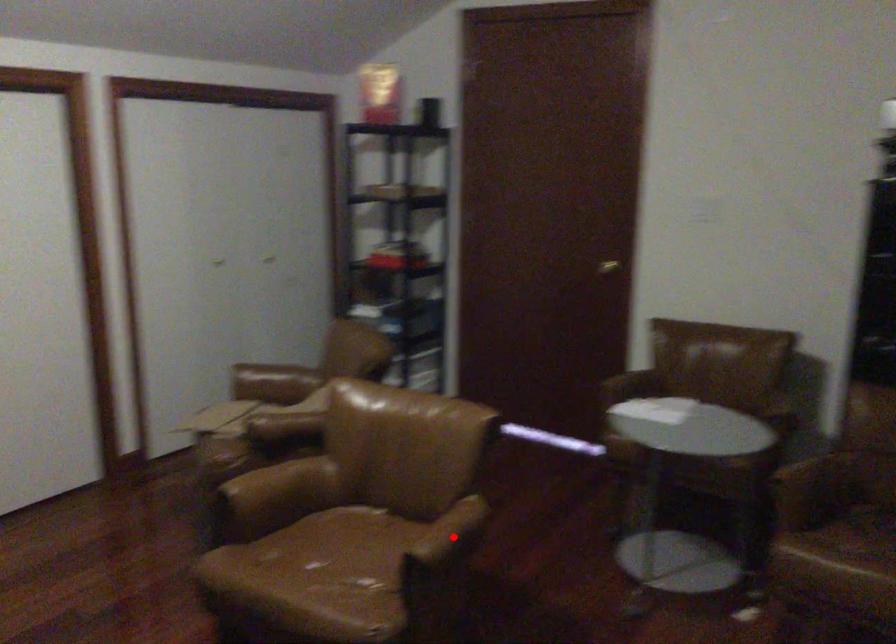
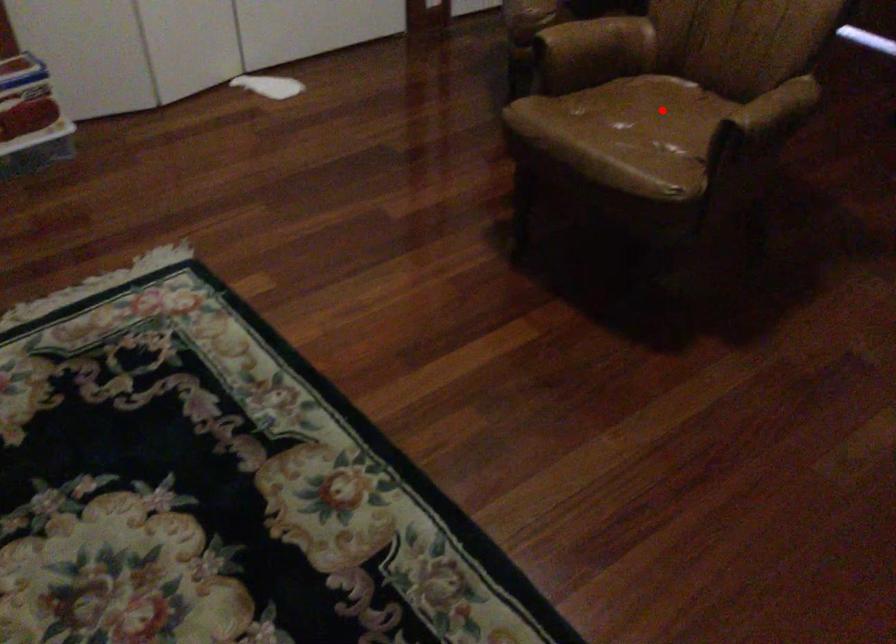
I am providing you with two images of the same scene from different viewpoints. A red point is marked on the first image and another point is marked on the second image. Is the red point in image1 aligned with the point shown in image2?

No